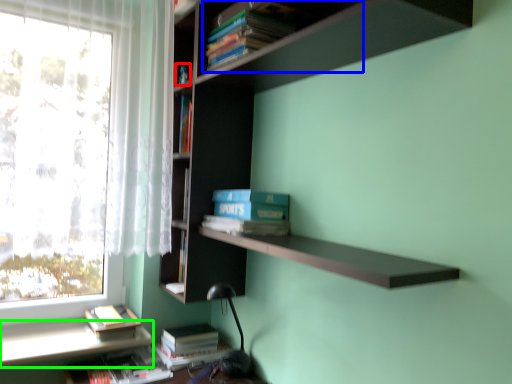
Question: Which object is the closest to the book (highlighted by a red box)? Choose among these: book (highlighted by a blue box) or window sill (highlighted by a green box).

Choices:
 (A) book
 (B) window sill

Answer: (A)